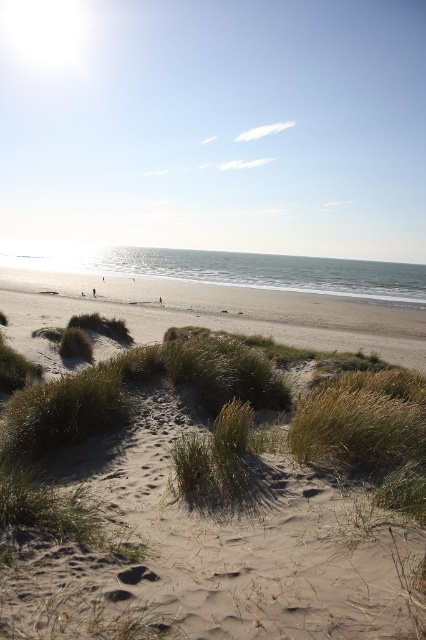
You are standing at the edge of the beach and want to take a photo of the sandy beige dunes at center. If your camera can focus on objects up to 10 feet away, will the dunes be in focus?

The sandy beige dunes at center are 8.82 feet away from the camera, which is within the 10 feet focus range. Therefore, the dunes will be in focus.

You are standing on the beach and want to walk from the sandy beige dunes at center to the brown sand at lower center. Which direction should you move to reach your destination?

You should move upward because the sandy beige dunes at center is located below the brown sand at lower center.

You are standing at the center of the image. Looking at the sandy beige dunes at center, can you tell me their exact coordinates?

The sandy beige dunes at center are located at coordinates point [249,545].